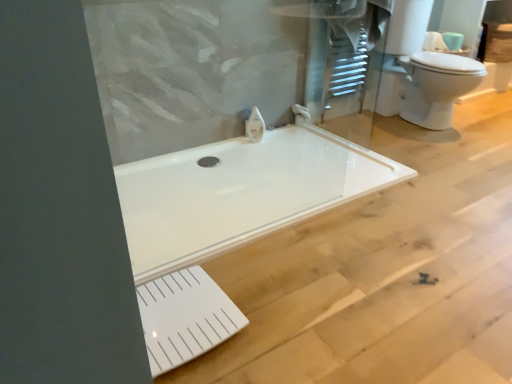
You are a GUI agent. You are given a task and a screenshot of the screen. Output one action in this format:
    pyautogui.click(x=<x>, y=<y>)
    Task: Click on the vacant area that lies to the right of white glossy faucet at upper center, positioned as the second faucet in back-to-front order
    The image size is (512, 384).
    Given the screenshot: What is the action you would take?
    pyautogui.click(x=285, y=142)